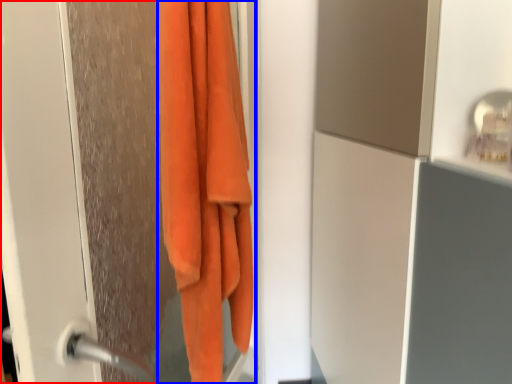
Question: Among these objects, which one is farthest to the camera, screen door (highlighted by a red box) or towel (highlighted by a blue box)?

Choices:
 (A) screen door
 (B) towel

Answer: (B)